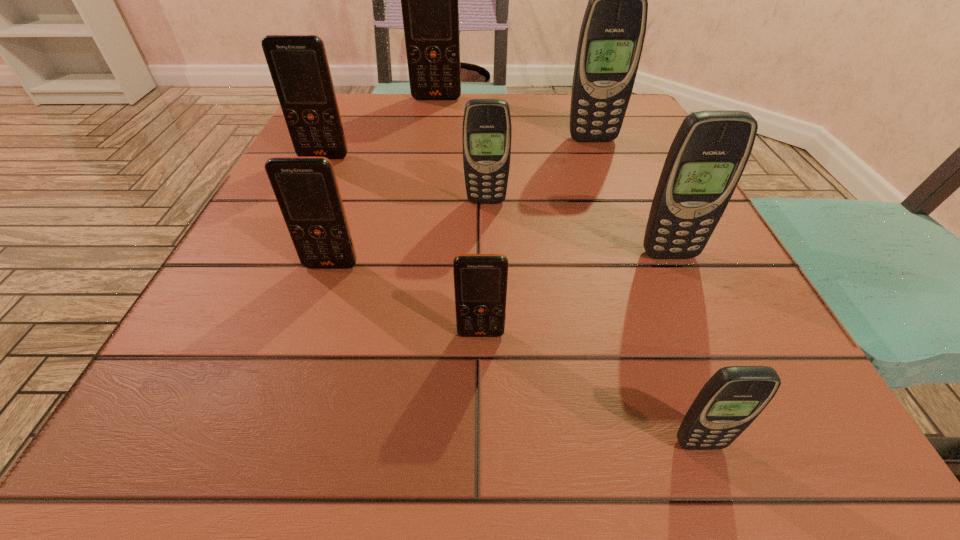
The width and height of the screenshot is (960, 540). What are the coordinates of `free space at the far left corner of the desktop` in the screenshot? It's located at (357, 100).

Image resolution: width=960 pixels, height=540 pixels. I want to click on free spot at the far right corner of the desktop, so click(x=639, y=109).

This screenshot has width=960, height=540. Find the location of `vacant region between the leftmost gray cellular telephone and the second farthest orange cellular telephone`. vacant region between the leftmost gray cellular telephone and the second farthest orange cellular telephone is located at coordinates (405, 179).

Where is `free point between the nearest gray cellular telephone and the biggest orange cellular telephone`? This screenshot has width=960, height=540. free point between the nearest gray cellular telephone and the biggest orange cellular telephone is located at coordinates (567, 271).

Find the location of a particular element. free point between the fourth nearest cellular telephone and the farthest gray cellular telephone is located at coordinates (631, 197).

Identify the location of empty location between the seventh nearest object and the fourth farthest cellular telephone. (540, 170).

Locate an element on the screen. The height and width of the screenshot is (540, 960). unoccupied position between the sixth farthest object and the farthest object is located at coordinates (384, 182).

Locate an element on the screen. The height and width of the screenshot is (540, 960). unoccupied position between the third object from left to right and the second smallest orange cellular telephone is located at coordinates (384, 182).

Image resolution: width=960 pixels, height=540 pixels. In order to click on empty space that is in between the fifth nearest cellular telephone and the smallest gray cellular telephone in this screenshot , I will do `click(592, 322)`.

The height and width of the screenshot is (540, 960). I want to click on free space between the fourth farthest cellular telephone and the sixth nearest cellular telephone, so click(x=405, y=179).